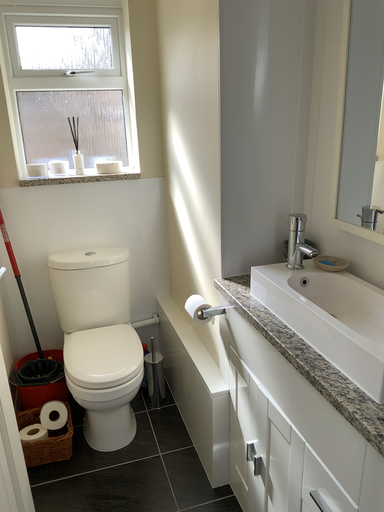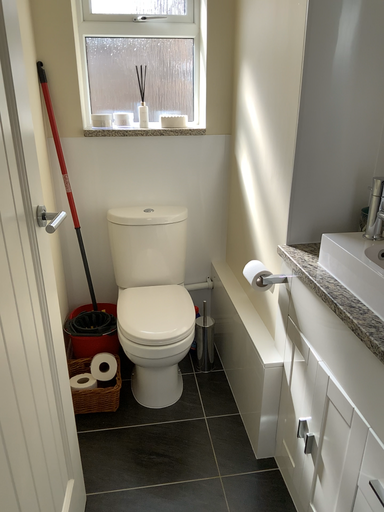
Question: Which way did the camera rotate in the video?

Choices:
 (A) rotated left
 (B) rotated right

Answer: (A)